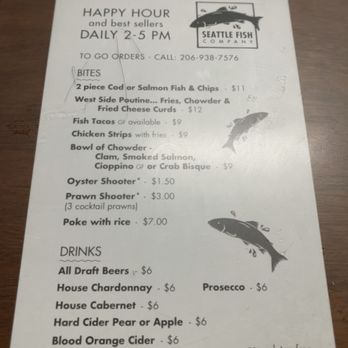
Identify the location of black wood table, background. (323, 205).